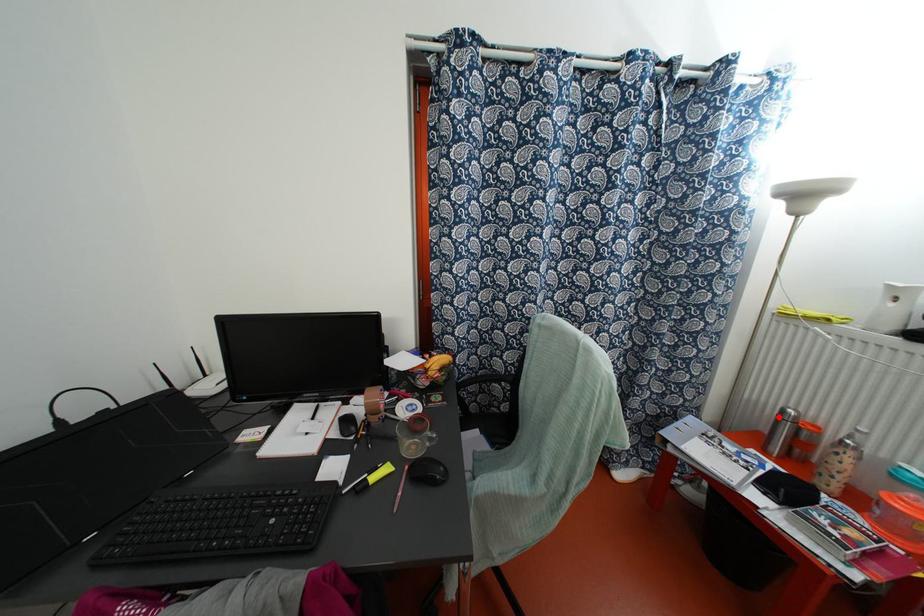
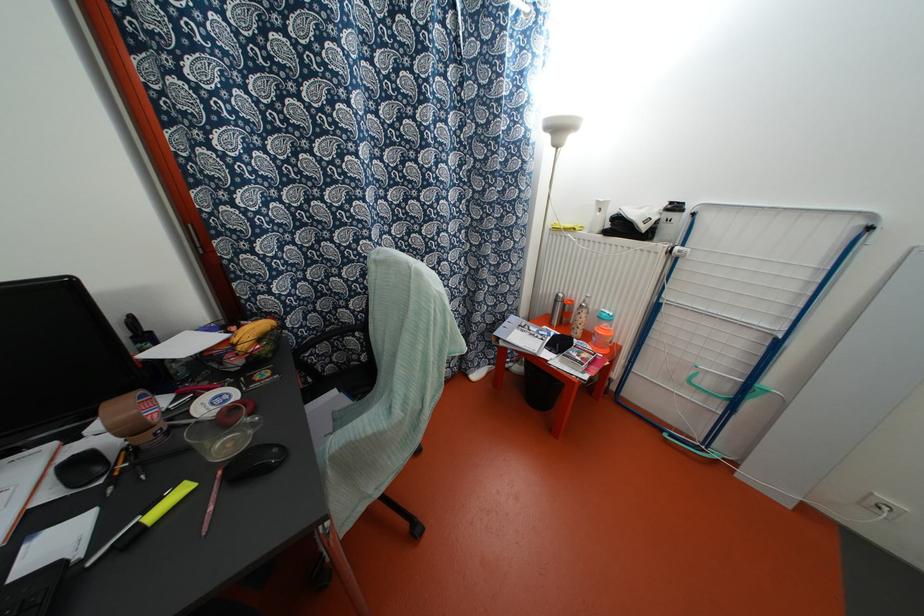
Question: I am providing you with two images of the same scene from different viewpoints. A red point is shown in image1. For the corresponding object point in image2, is it positioned nearer or farther from the camera?

Choices:
 (A) Nearer
 (B) Farther

Answer: (A)